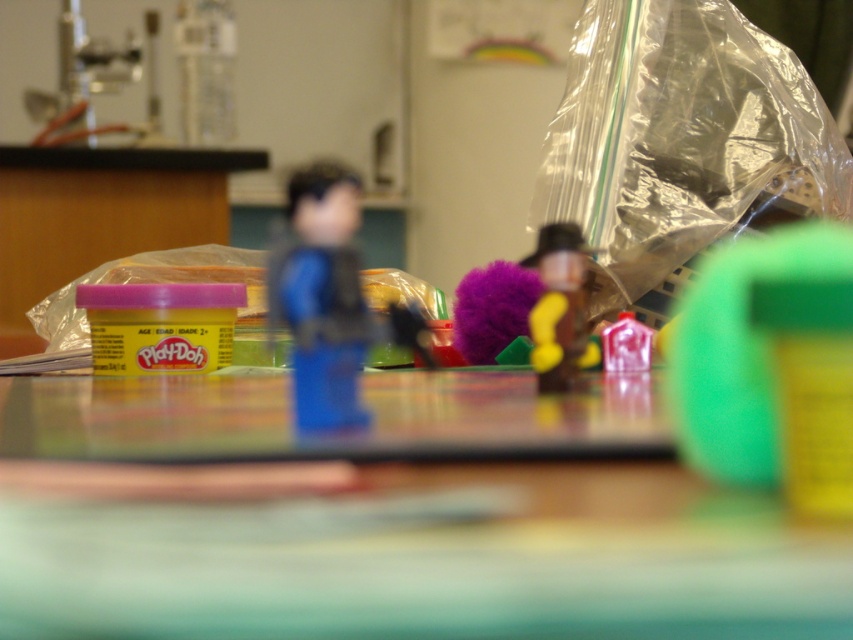
This screenshot has width=853, height=640. I want to click on transparent plastic bag at right, so (x=682, y=141).

Is transparent plastic bag at right to the left of blue plastic figure at center from the viewer's perspective?

Incorrect, transparent plastic bag at right is not on the left side of blue plastic figure at center.

Find the location of a particular element. This screenshot has height=640, width=853. transparent plastic bag at right is located at coordinates (682, 141).

Does transparent plastic bag at right have a smaller size compared to pink matte play-doh at center?

No.

Who is positioned more to the right, transparent plastic bag at right or pink matte play-doh at center?

transparent plastic bag at right is more to the right.

Which is behind, point (706, 134) or point (635, 348)?

Point (706, 134)

In order to click on transparent plastic bag at right in this screenshot , I will do `click(682, 141)`.

Between blue plastic figure at center and smooth brown figurine at center, which one is positioned lower?

smooth brown figurine at center is below.

From the picture: Who is more forward, (x=306, y=387) or (x=563, y=358)?

Positioned in front is point (x=306, y=387).

Which is in front, point (311, 257) or point (544, 257)?

Point (311, 257) is more forward.

Identify the location of blue plastic figure at center. The image size is (853, 640). (321, 296).